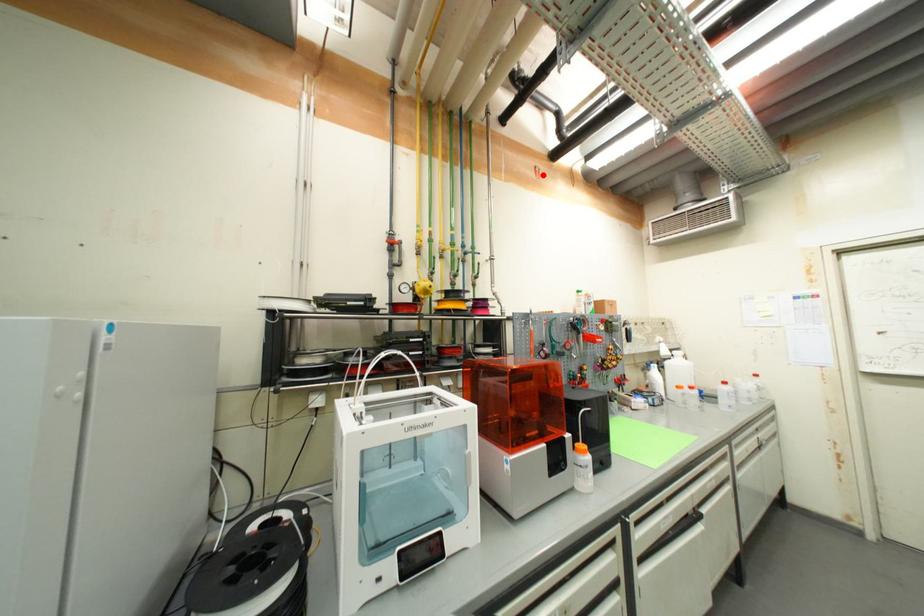
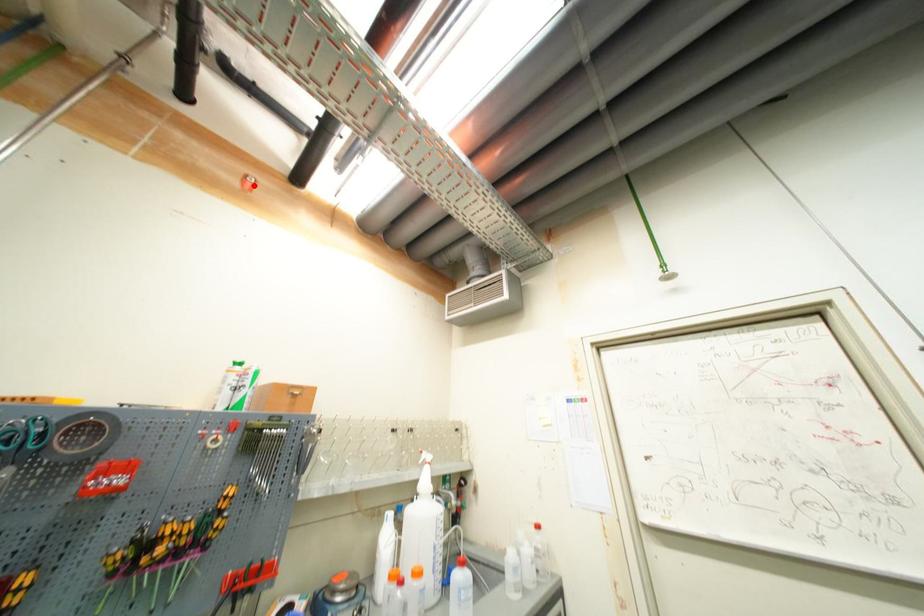
I am providing you with two images of the same scene from different viewpoints. A red point is marked on the first image and another point is marked on the second image. Are the points marked in image1 and image2 representing the same 3D position?

Yes